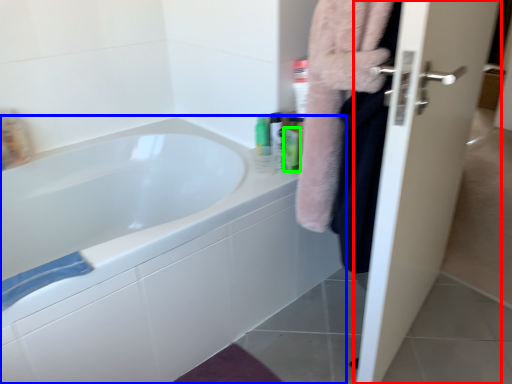
Question: Estimate the real-world distances between objects in this image. Which object is farther from door (highlighted by a red box), bathtub (highlighted by a blue box) or mouthwash (highlighted by a green box)?

Choices:
 (A) bathtub
 (B) mouthwash

Answer: (B)